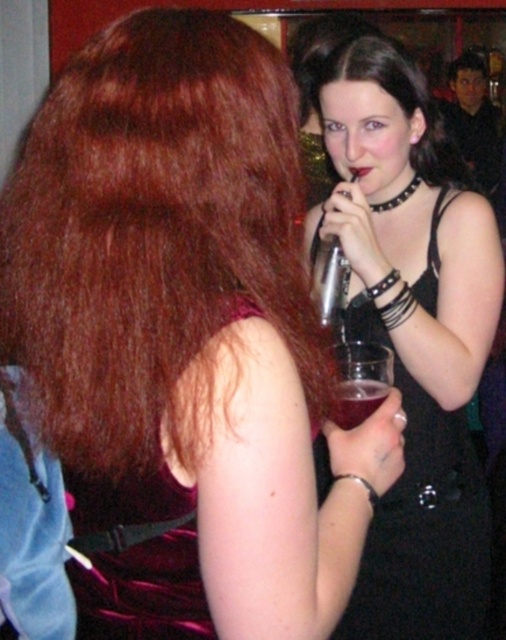
Question: Is velvet purple dress at upper left above translucent plastic wine glass at upper right?

Choices:
 (A) yes
 (B) no

Answer: (B)

Question: Which object appears farthest from the camera in this image?

Choices:
 (A) black leather dress at center
 (B) translucent plastic wine glass at upper right
 (C) velvet purple dress at upper left

Answer: (A)

Question: Does black leather dress at center have a greater width compared to velvet purple dress at upper left?

Choices:
 (A) no
 (B) yes

Answer: (B)

Question: Which object is closer to the camera taking this photo?

Choices:
 (A) translucent plastic wine glass at upper right
 (B) black leather dress at center

Answer: (A)

Question: Which object is positioned closest to the black leather dress at center?

Choices:
 (A) translucent plastic wine glass at upper right
 (B) velvet purple dress at upper left

Answer: (A)

Question: Can you confirm if black leather dress at center is positioned to the right of velvet purple dress at upper left?

Choices:
 (A) yes
 (B) no

Answer: (A)